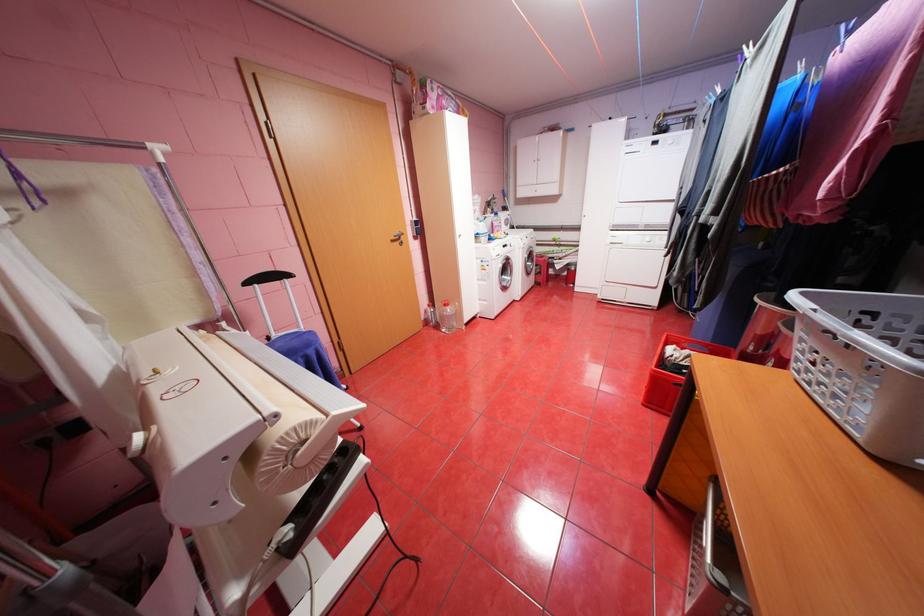
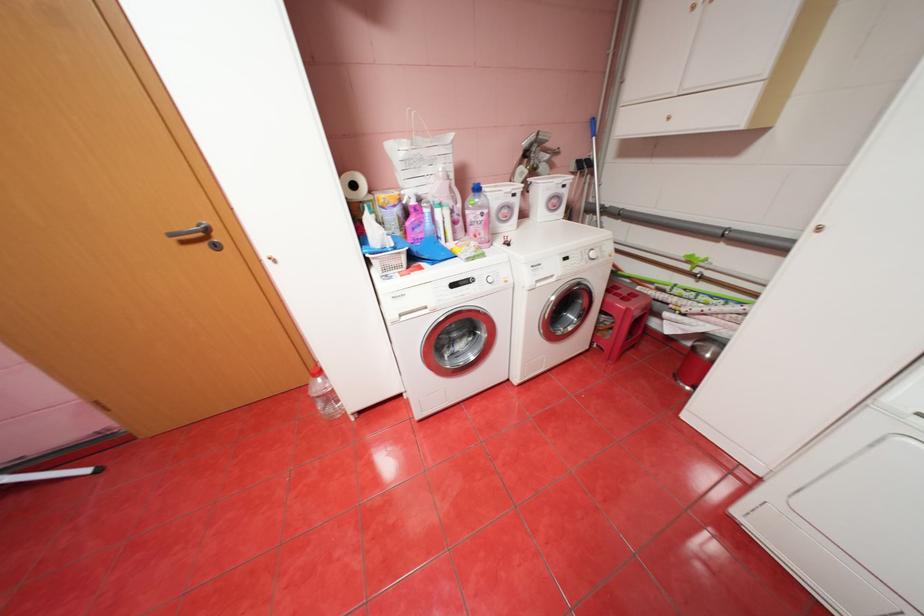
In the second image, find the point that corresponds to point 516,219 in the first image.

(566, 197)